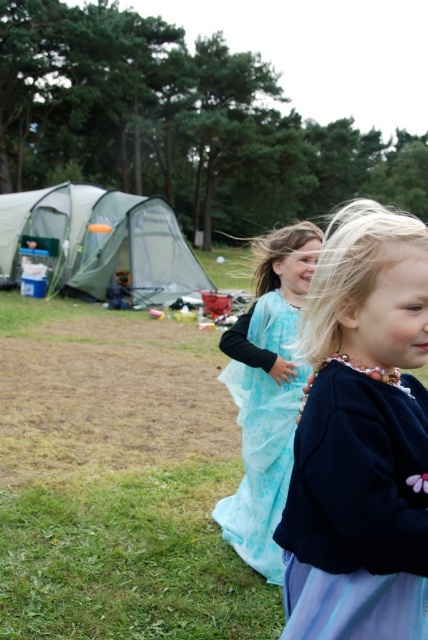
Can you confirm if blue satin dress at center is shorter than green grass at lower left?

Incorrect, blue satin dress at center's height does not fall short of green grass at lower left's.

Who is higher up, blue satin dress at center or green grass at lower left?

blue satin dress at center is above.

Image resolution: width=428 pixels, height=640 pixels. What do you see at coordinates (362, 436) in the screenshot? I see `blue satin dress at center` at bounding box center [362, 436].

The height and width of the screenshot is (640, 428). In order to click on blue satin dress at center in this screenshot , I will do `click(362, 436)`.

Between point (95, 196) and point (252, 509), which one is positioned behind?

Positioned behind is point (95, 196).

Is green fabric tent at left thinner than light blue silky dress at center?

No.

At what (x,y) coordinates should I click in order to perform the action: click on green fabric tent at left. Please return your answer as a coordinate pair (x, y). This screenshot has height=640, width=428. Looking at the image, I should click on (100, 243).

Can you confirm if green grass at lower left is bigger than green fabric tent at left?

Actually, green grass at lower left might be smaller than green fabric tent at left.

Is green grass at lower left above green fabric tent at left?

No, green grass at lower left is not above green fabric tent at left.

The width and height of the screenshot is (428, 640). I want to click on green grass at lower left, so click(x=127, y=561).